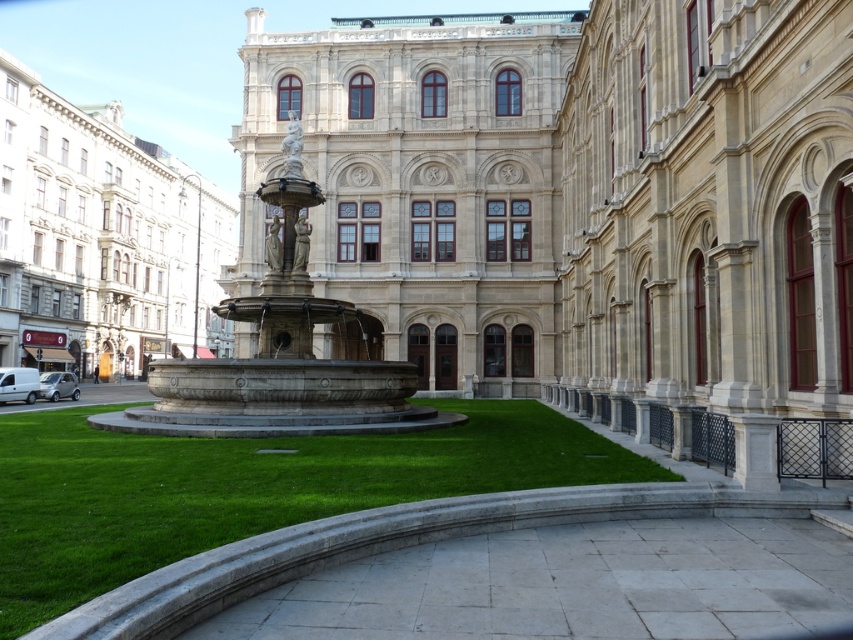
The width and height of the screenshot is (853, 640). Describe the element at coordinates (102, 240) in the screenshot. I see `marble fountain at center` at that location.

Can you confirm if marble fountain at center is bigger than matte stone statue at center?

Indeed, marble fountain at center has a larger size compared to matte stone statue at center.

Between point (48, 294) and point (276, 241), which one is positioned in front?

Point (276, 241) is more forward.

The image size is (853, 640). What are the coordinates of `marble fountain at center` in the screenshot? It's located at (102, 240).

Consider the image. Is green grass at center below marble fountain at center?

Yes.

Is green grass at center to the left of marble fountain at center from the viewer's perspective?

Incorrect, green grass at center is not on the left side of marble fountain at center.

Locate an element on the screen. The width and height of the screenshot is (853, 640). green grass at center is located at coordinates (245, 488).

Does green grass at center appear on the left side of white marble statue at upper center?

In fact, green grass at center is to the right of white marble statue at upper center.

Describe the element at coordinates (245, 488) in the screenshot. This screenshot has height=640, width=853. I see `green grass at center` at that location.

Measure the distance between green grass at center and camera.

The distance of green grass at center from camera is 15.92 feet.

Locate an element on the screen. This screenshot has height=640, width=853. green grass at center is located at coordinates (245, 488).